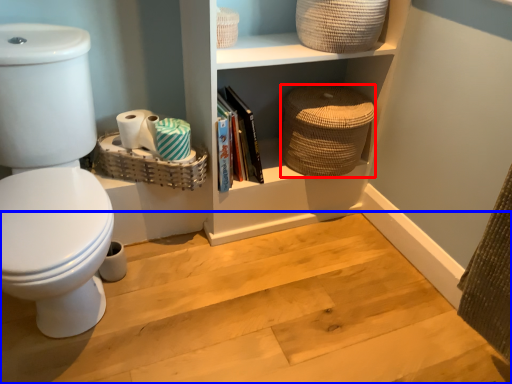
Question: Which point is further to the camera, basket (highlighted by a red box) or stair (highlighted by a blue box)?

Choices:
 (A) basket
 (B) stair

Answer: (A)